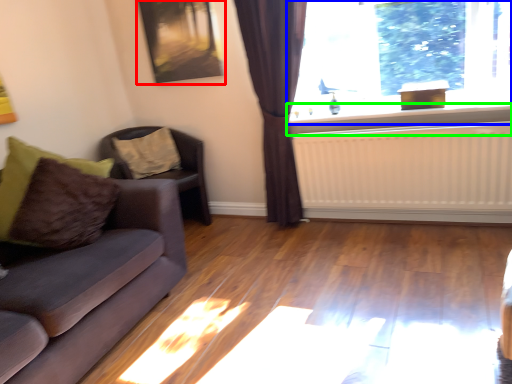
Question: Which is farther away from picture frame (highlighted by a red box)? window (highlighted by a blue box) or window sill (highlighted by a green box)?

Choices:
 (A) window
 (B) window sill

Answer: (B)